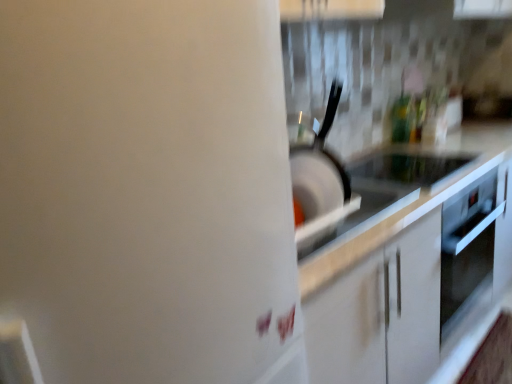
Question: Does white glossy countertop at center come in front of black glass cooktop at center?

Choices:
 (A) no
 (B) yes

Answer: (B)

Question: Is white glossy countertop at center oriented towards black glass cooktop at center?

Choices:
 (A) yes
 (B) no

Answer: (B)

Question: From a real-world perspective, is white glossy countertop at center over black glass cooktop at center?

Choices:
 (A) yes
 (B) no

Answer: (B)

Question: Is white glossy countertop at center positioned far away from black glass cooktop at center?

Choices:
 (A) yes
 (B) no

Answer: (B)

Question: Can black glass cooktop at center be found inside white glossy countertop at center?

Choices:
 (A) yes
 (B) no

Answer: (A)

Question: In the image, is black glass cooktop at center positioned in front of or behind black matte frying pan at center?

Choices:
 (A) front
 (B) behind

Answer: (B)

Question: From a real-world perspective, is black glass cooktop at center above or below black matte frying pan at center?

Choices:
 (A) below
 (B) above

Answer: (A)

Question: Is black glass cooktop at center inside or outside of black matte frying pan at center?

Choices:
 (A) inside
 (B) outside

Answer: (B)

Question: Considering the positions of black glass cooktop at center and black matte frying pan at center in the image, is black glass cooktop at center taller or shorter than black matte frying pan at center?

Choices:
 (A) tall
 (B) short

Answer: (B)

Question: From the image's perspective, is black matte frying pan at center positioned above or below white glossy water heater at upper right?

Choices:
 (A) below
 (B) above

Answer: (B)

Question: From a real-world perspective, is black matte frying pan at center physically located above or below white glossy water heater at upper right?

Choices:
 (A) above
 (B) below

Answer: (A)

Question: Is black matte frying pan at center wider or thinner than white glossy water heater at upper right?

Choices:
 (A) wide
 (B) thin

Answer: (B)

Question: Is black matte frying pan at center situated inside white glossy water heater at upper right or outside?

Choices:
 (A) inside
 (B) outside

Answer: (B)

Question: Is white glossy countertop at center taller or shorter than black glass cooktop at center?

Choices:
 (A) short
 (B) tall

Answer: (B)

Question: Is point (444, 249) closer or farther from the camera than point (387, 157)?

Choices:
 (A) closer
 (B) farther

Answer: (A)